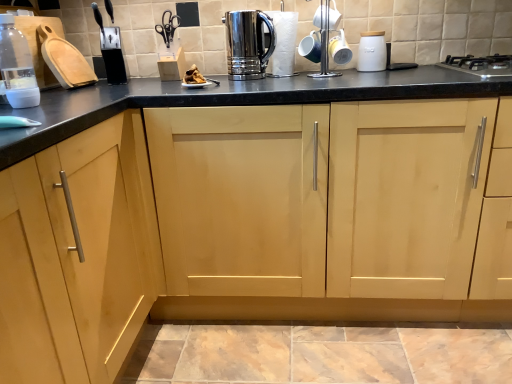
Question: Which direction should I rotate to look at polished stainless steel coffee pot at upper center, the 2th appliance from the left?

Choices:
 (A) left
 (B) right

Answer: (B)

Question: Would you say black stainless steel gas stove at upper right contains black plastic knife block at upper left, the first appliance from the left?

Choices:
 (A) yes
 (B) no

Answer: (B)

Question: Considering the relative sizes of black stainless steel gas stove at upper right and black plastic knife block at upper left, the 4th appliance viewed from the right, in the image provided, is black stainless steel gas stove at upper right taller than black plastic knife block at upper left, the 4th appliance viewed from the right,?

Choices:
 (A) yes
 (B) no

Answer: (B)

Question: Is black stainless steel gas stove at upper right positioned before black plastic knife block at upper left, the first appliance from the left?

Choices:
 (A) no
 (B) yes

Answer: (B)

Question: Is black stainless steel gas stove at upper right thinner than black plastic knife block at upper left, the first appliance from the left?

Choices:
 (A) yes
 (B) no

Answer: (B)

Question: Does black stainless steel gas stove at upper right appear on the right side of black plastic knife block at upper left, the first appliance from the left?

Choices:
 (A) yes
 (B) no

Answer: (A)

Question: Can you confirm if black stainless steel gas stove at upper right is wider than black plastic knife block at upper left, the first appliance from the left?

Choices:
 (A) no
 (B) yes

Answer: (B)

Question: From the image's perspective, would you say polished stainless steel kettle at center is positioned over polished stainless steel coffee pot at upper center, the 3th appliance in the right-to-left sequence?

Choices:
 (A) no
 (B) yes

Answer: (A)

Question: Is polished stainless steel kettle at center thinner than polished stainless steel coffee pot at upper center, the 2th appliance from the left?

Choices:
 (A) yes
 (B) no

Answer: (B)

Question: Is polished stainless steel kettle at center wider than polished stainless steel coffee pot at upper center, the 2th appliance from the left?

Choices:
 (A) no
 (B) yes

Answer: (B)

Question: From a real-world perspective, is polished stainless steel kettle at center located higher than polished stainless steel coffee pot at upper center, the 2th appliance from the left?

Choices:
 (A) yes
 (B) no

Answer: (B)

Question: Is polished stainless steel kettle at center located outside polished stainless steel coffee pot at upper center, the 2th appliance from the left?

Choices:
 (A) no
 (B) yes

Answer: (B)

Question: Does polished stainless steel kettle at center touch polished stainless steel coffee pot at upper center, the 2th appliance from the left?

Choices:
 (A) no
 (B) yes

Answer: (B)

Question: Can you confirm if white matte bottle at left is bigger than polished stainless steel coffee pot at upper center, the 3th appliance in the right-to-left sequence?

Choices:
 (A) yes
 (B) no

Answer: (B)